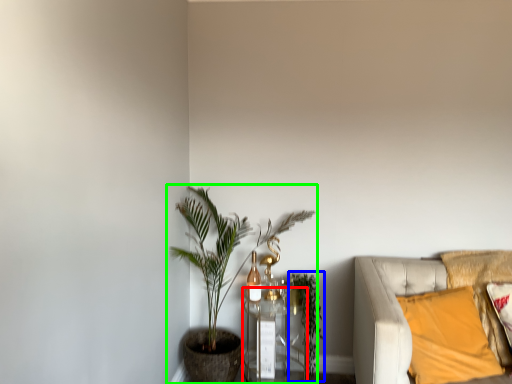
Question: Considering the real-world distances, which object is closest to table (highlighted by a red box)? vegetation (highlighted by a blue box) or houseplant (highlighted by a green box).

Choices:
 (A) vegetation
 (B) houseplant

Answer: (A)